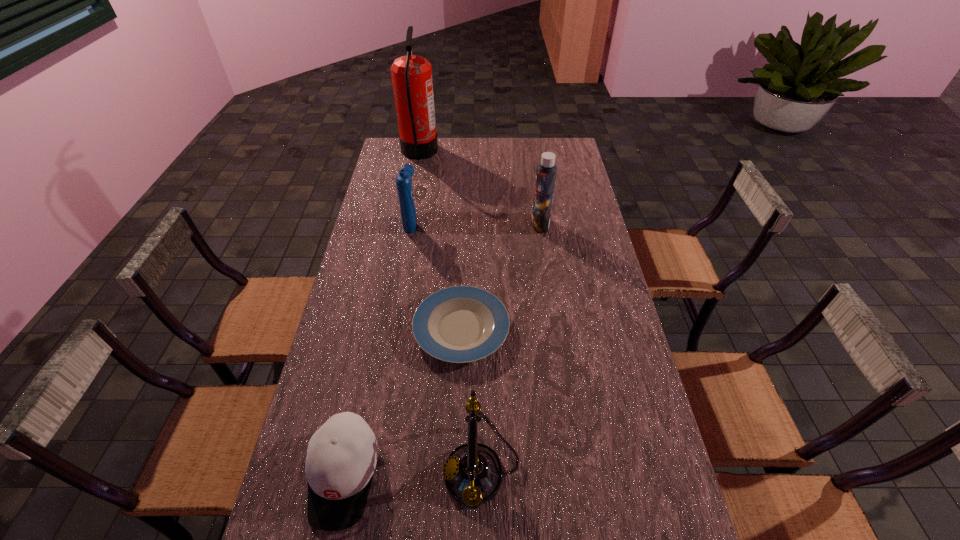
I want to click on free space between the shorter shampoo and the right shampoo, so click(x=476, y=223).

At what (x,y) coordinates should I click in order to perform the action: click on vacant region between the fourth farthest object and the second shortest object. Please return your answer as a coordinate pair (x, y). This screenshot has height=540, width=960. Looking at the image, I should click on (402, 402).

Where is `empty space between the fire extinguisher and the right shampoo`? The image size is (960, 540). empty space between the fire extinguisher and the right shampoo is located at coordinates (480, 188).

You are a GUI agent. You are given a task and a screenshot of the screen. Output one action in this format:
    pyautogui.click(x=<x>, y=<y>)
    Task: Click on the empty space between the third tallest object and the baseball cap
    
    Given the screenshot: What is the action you would take?
    pyautogui.click(x=377, y=348)

What are the coordinates of `vacant space that's between the plate and the fire extinguisher` in the screenshot? It's located at (441, 240).

Choose which object is the nearest neighbor to the left shampoo. Please provide its 2D coordinates. Your answer should be formatted as a tuple, i.e. [(x, y)], where the tuple contains the x and y coordinates of a point satisfying the conditions above.

[(460, 324)]

This screenshot has height=540, width=960. Identify the location of object that is the fourth closest one to the fourth shortest object. (473, 473).

At what (x,y) coordinates should I click in order to perform the action: click on free location that satisfies the following two spatial constraints: 1. on the front side of the fire extinguisher; 2. on the right side of the left shampoo. Please return your answer as a coordinate pair (x, y). Looking at the image, I should click on (407, 222).

Where is `vacant space that satisfies the following two spatial constraints: 1. on the front label of the rightmost object; 2. on the front side of the shortest object`? vacant space that satisfies the following two spatial constraints: 1. on the front label of the rightmost object; 2. on the front side of the shortest object is located at coordinates (556, 329).

What are the coordinates of `free spot that satisfies the following two spatial constraints: 1. on the back side of the shortest object; 2. on the front side of the farthest object` in the screenshot? It's located at pyautogui.click(x=468, y=152).